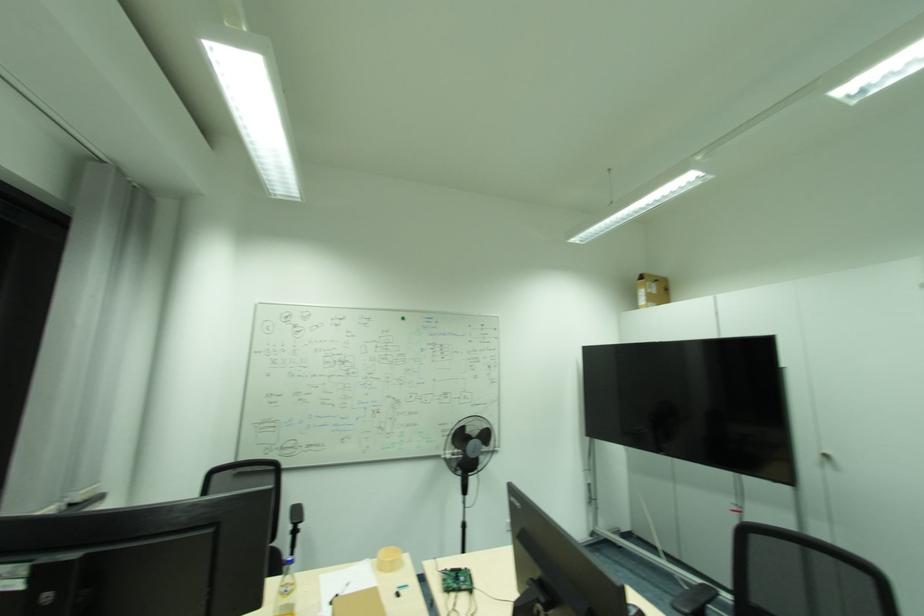
You are a GUI agent. You are given a task and a screenshot of the screen. Output one action in this format:
    pyautogui.click(x=<x>, y=<y>)
    Task: Click on the silver cabinet handle
    This screenshot has height=616, width=924.
    Given the screenshot: What is the action you would take?
    pyautogui.click(x=828, y=460)